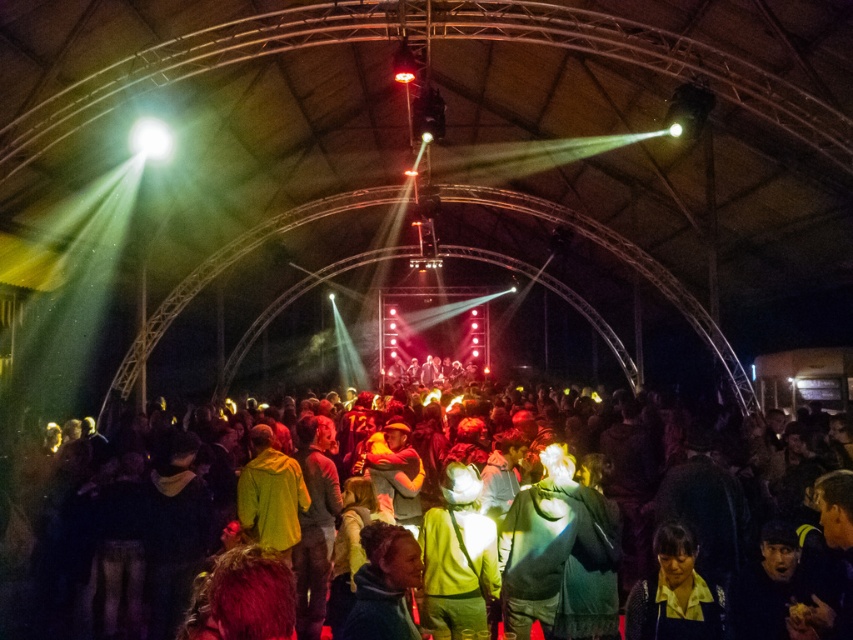
Does green fabric shirt at center have a greater width compared to matte green jacket at center?

Yes.

Which is more to the right, green fabric shirt at center or matte green jacket at center?

green fabric shirt at center

You are a GUI agent. You are given a task and a screenshot of the screen. Output one action in this format:
    pyautogui.click(x=<x>, y=<y>)
    Task: Click on the green fabric shirt at center
    The height and width of the screenshot is (640, 853).
    Given the screenshot: What is the action you would take?
    pyautogui.click(x=556, y=552)

Can you confirm if green fabric shirt at center is shorter than yellow fabric shirt at lower right?

In fact, green fabric shirt at center may be taller than yellow fabric shirt at lower right.

From the picture: Can you confirm if green fabric shirt at center is taller than yellow fabric shirt at lower right?

Yes, green fabric shirt at center is taller than yellow fabric shirt at lower right.

Between point (561, 493) and point (692, 579), which one is positioned in front?

Point (692, 579) is in front.

Image resolution: width=853 pixels, height=640 pixels. I want to click on green fabric shirt at center, so click(x=556, y=552).

Can you confirm if yellow fabric shirt at lower right is taller than green fabric jacket at center?

Indeed, yellow fabric shirt at lower right has a greater height compared to green fabric jacket at center.

Can you confirm if yellow fabric shirt at lower right is wider than green fabric jacket at center?

Indeed, yellow fabric shirt at lower right has a greater width compared to green fabric jacket at center.

This screenshot has width=853, height=640. I want to click on yellow fabric shirt at lower right, so click(x=674, y=593).